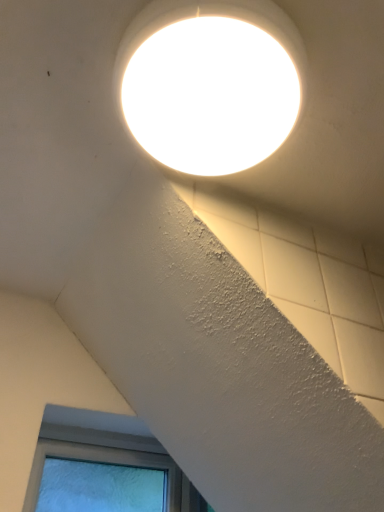
At what (x,y) coordinates should I click in order to perform the action: click on white glossy light fixture at upper center. Please return your answer as a coordinate pair (x, y). The width and height of the screenshot is (384, 512). Looking at the image, I should click on (210, 83).

What do you see at coordinates (210, 83) in the screenshot?
I see `white glossy light fixture at upper center` at bounding box center [210, 83].

In order to face white glossy light fixture at upper center, should I rotate leftwards or rightwards?

You should look right and rotate roughly 1.957 degrees.

Locate an element on the screen. Image resolution: width=384 pixels, height=512 pixels. white glossy light fixture at upper center is located at coordinates (210, 83).